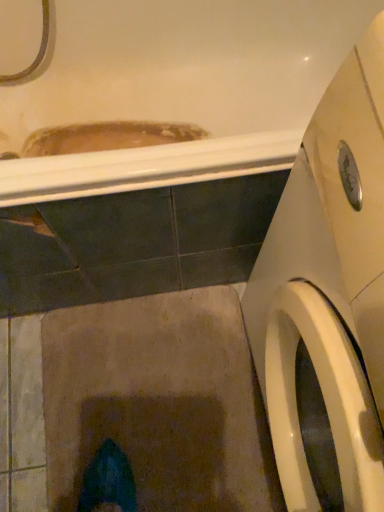
Question: From a real-world perspective, is white glossy washing machine at right over white glossy bathtub at upper center?

Choices:
 (A) yes
 (B) no

Answer: (A)

Question: Can you confirm if white glossy washing machine at right is wider than white glossy bathtub at upper center?

Choices:
 (A) yes
 (B) no

Answer: (B)

Question: From the image's perspective, is white glossy washing machine at right above white glossy bathtub at upper center?

Choices:
 (A) no
 (B) yes

Answer: (A)

Question: Is white glossy washing machine at right completely or partially outside of white glossy bathtub at upper center?

Choices:
 (A) yes
 (B) no

Answer: (A)

Question: Is white glossy washing machine at right aimed at white glossy bathtub at upper center?

Choices:
 (A) yes
 (B) no

Answer: (B)

Question: Considering the relative sizes of white glossy washing machine at right and white glossy bathtub at upper center in the image provided, is white glossy washing machine at right thinner than white glossy bathtub at upper center?

Choices:
 (A) no
 (B) yes

Answer: (B)

Question: From a real-world perspective, is white glossy bathtub at upper center positioned under white glossy washing machine at right based on gravity?

Choices:
 (A) yes
 (B) no

Answer: (A)

Question: Considering the relative sizes of white glossy bathtub at upper center and white glossy washing machine at right in the image provided, is white glossy bathtub at upper center smaller than white glossy washing machine at right?

Choices:
 (A) yes
 (B) no

Answer: (B)

Question: Is white glossy bathtub at upper center in front of white glossy washing machine at right?

Choices:
 (A) yes
 (B) no

Answer: (B)

Question: Is white glossy bathtub at upper center to the right of white glossy washing machine at right from the viewer's perspective?

Choices:
 (A) yes
 (B) no

Answer: (B)

Question: From a real-world perspective, is white glossy bathtub at upper center on top of white glossy washing machine at right?

Choices:
 (A) yes
 (B) no

Answer: (B)

Question: From the image's perspective, does white glossy bathtub at upper center appear lower than white glossy washing machine at right?

Choices:
 (A) yes
 (B) no

Answer: (B)

Question: Considering their positions, is white glossy bathtub at upper center located in front of or behind white glossy washing machine at right?

Choices:
 (A) behind
 (B) front

Answer: (A)